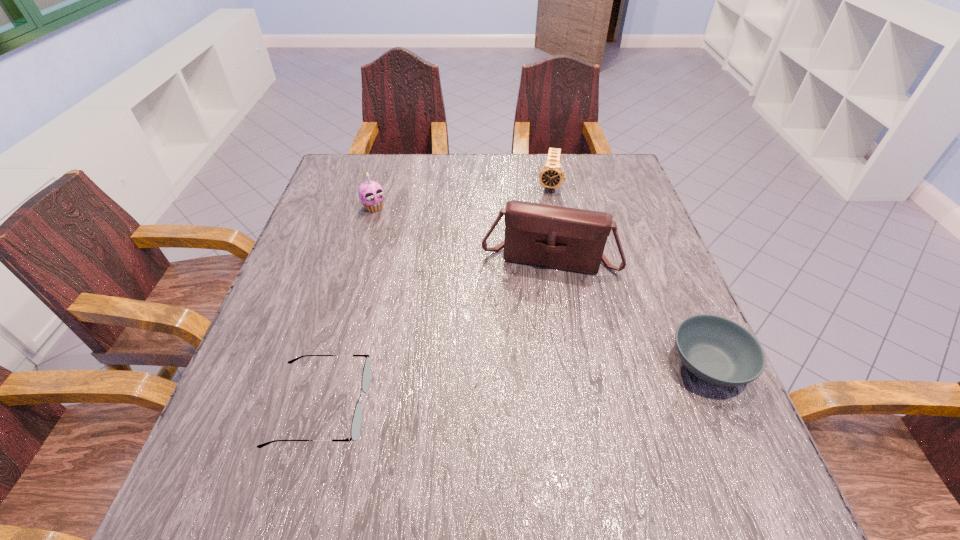
You are a GUI agent. You are given a task and a screenshot of the screen. Output one action in this format:
    pyautogui.click(x=<x>, y=<y>)
    Task: Click on the vacant spot on the desktop that is between the spectacles and the soup bowl and is positioned on the face of the farthest object
    The height and width of the screenshot is (540, 960).
    Given the screenshot: What is the action you would take?
    pyautogui.click(x=515, y=385)

Find the location of a particular element. Image resolution: width=960 pixels, height=540 pixels. free space on the desktop that is between the spectacles and the soup bowl and is positioned on the face of the cupcake is located at coordinates (520, 384).

Find the location of a particular element. free space on the desktop that is between the spectacles and the rightmost object and is positioned on the front flap of the third farthest object is located at coordinates (532, 383).